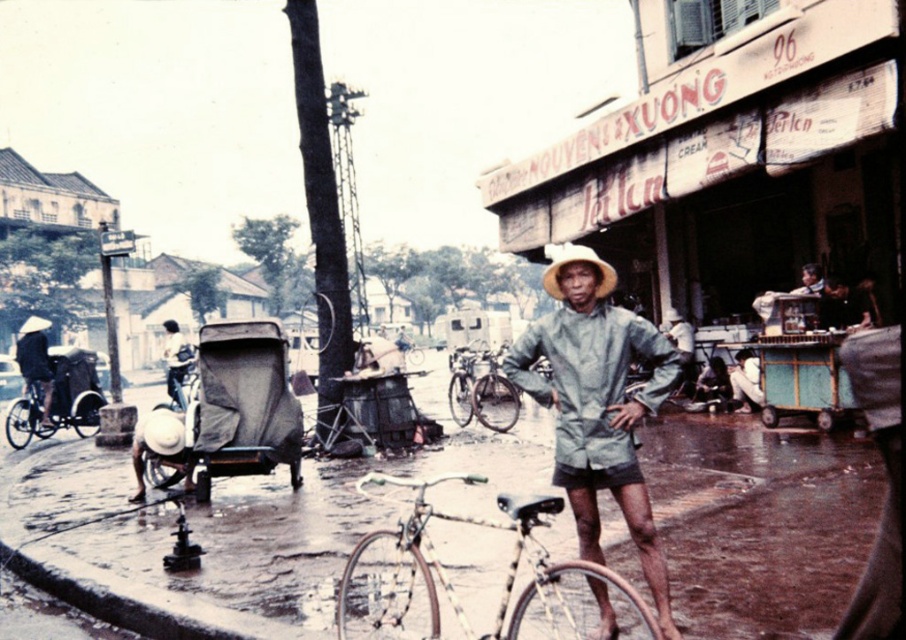
Is light gray fabric raincoat at center wider than light brown straw hat at left?

No, light gray fabric raincoat at center is not wider than light brown straw hat at left.

The width and height of the screenshot is (906, 640). What are the coordinates of `light gray fabric raincoat at center` in the screenshot? It's located at (596, 404).

Where is `light gray fabric raincoat at center`? light gray fabric raincoat at center is located at coordinates (596, 404).

Does silver metallic bicycle at center have a larger size compared to light brown straw hat at left?

Actually, silver metallic bicycle at center might be smaller than light brown straw hat at left.

Is silver metallic bicycle at center below light brown straw hat at left?

Indeed, silver metallic bicycle at center is positioned under light brown straw hat at left.

Between point (569, 572) and point (32, 376), which one is positioned behind?

Positioned behind is point (32, 376).

The height and width of the screenshot is (640, 906). Find the location of `silver metallic bicycle at center`. silver metallic bicycle at center is located at coordinates (450, 580).

Measure the distance between light gray fabric raincoat at center and camera.

A distance of 3.27 meters exists between light gray fabric raincoat at center and camera.

Between light gray fabric raincoat at center and natural straw hat at center, which one appears on the left side from the viewer's perspective?

natural straw hat at center is more to the left.

Image resolution: width=906 pixels, height=640 pixels. What do you see at coordinates (596, 404) in the screenshot?
I see `light gray fabric raincoat at center` at bounding box center [596, 404].

Identify the location of light gray fabric raincoat at center. This screenshot has width=906, height=640. (596, 404).